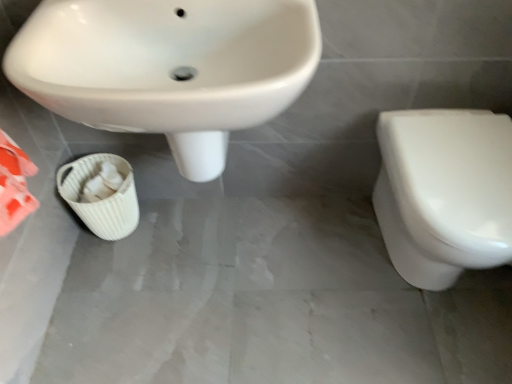
Locate an element on the screen. The height and width of the screenshot is (384, 512). vacant area situated below white glossy sink at upper left (from a real-world perspective) is located at coordinates (215, 253).